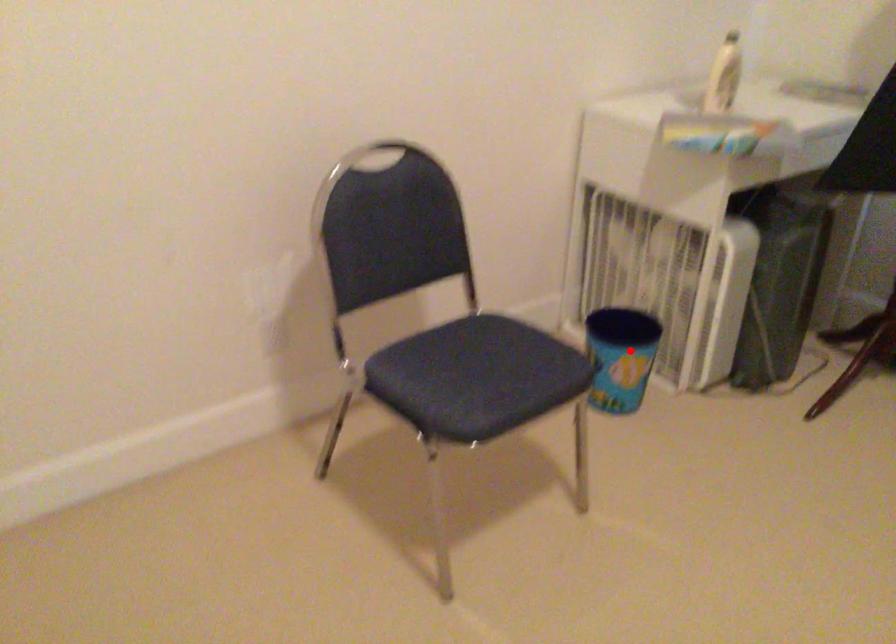
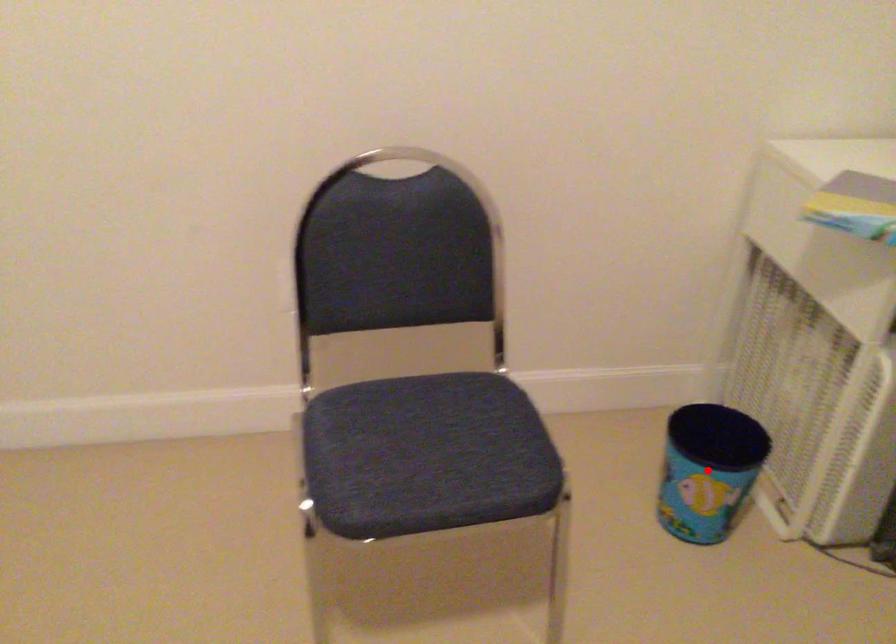
I am providing you with two images of the same scene from different viewpoints. A red point is marked on the first image and another point is marked on the second image. Are the points marked in image1 and image2 representing the same 3D position?

Yes